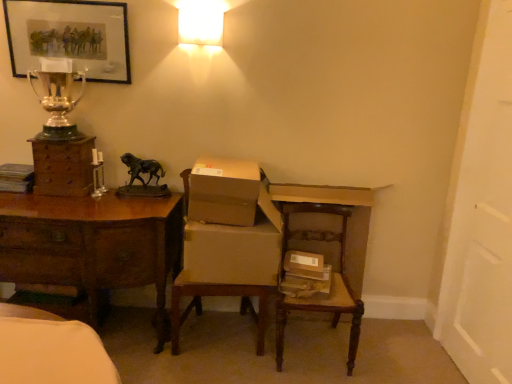
Question: Does white frosted glass at upper center come behind wooden chest of drawers at left?

Choices:
 (A) no
 (B) yes

Answer: (A)

Question: From the image's perspective, is white frosted glass at upper center over wooden chest of drawers at left?

Choices:
 (A) no
 (B) yes

Answer: (B)

Question: Is white frosted glass at upper center aimed at wooden chest of drawers at left?

Choices:
 (A) no
 (B) yes

Answer: (A)

Question: Is wooden chest of drawers at left surrounded by white frosted glass at upper center?

Choices:
 (A) no
 (B) yes

Answer: (A)

Question: Is white frosted glass at upper center shorter than wooden chest of drawers at left?

Choices:
 (A) yes
 (B) no

Answer: (A)

Question: Can you confirm if white frosted glass at upper center is positioned to the left of wooden chest of drawers at left?

Choices:
 (A) no
 (B) yes

Answer: (A)

Question: Is bronze/statue at center at the left side of brown cardboard box at center, the 1th cardboard box from the top?

Choices:
 (A) yes
 (B) no

Answer: (A)

Question: Is brown cardboard box at center, the second cardboard box ordered from the bottom, at the back of bronze/statue at center?

Choices:
 (A) no
 (B) yes

Answer: (A)

Question: Is bronze/statue at center positioned before brown cardboard box at center, the second cardboard box ordered from the bottom?

Choices:
 (A) no
 (B) yes

Answer: (A)

Question: From the image's perspective, is bronze/statue at center on top of brown cardboard box at center, the 1th cardboard box from the top?

Choices:
 (A) no
 (B) yes

Answer: (B)

Question: Is bronze/statue at center surrounding brown cardboard box at center, the 1th cardboard box from the top?

Choices:
 (A) no
 (B) yes

Answer: (A)

Question: From the image's perspective, does bronze/statue at center appear lower than brown cardboard box at center, the 1th cardboard box from the top?

Choices:
 (A) no
 (B) yes

Answer: (A)

Question: Is brown cardboard chair at center thinner than brown wood desk at left?

Choices:
 (A) yes
 (B) no

Answer: (A)